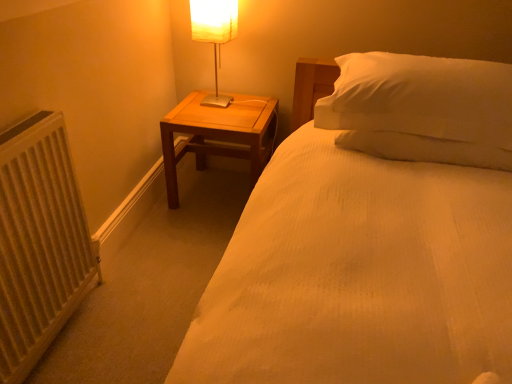
Where is `empty space that is ontop of white textured radiator at left (from a real-world perspective)`? The height and width of the screenshot is (384, 512). empty space that is ontop of white textured radiator at left (from a real-world perspective) is located at coordinates (24, 127).